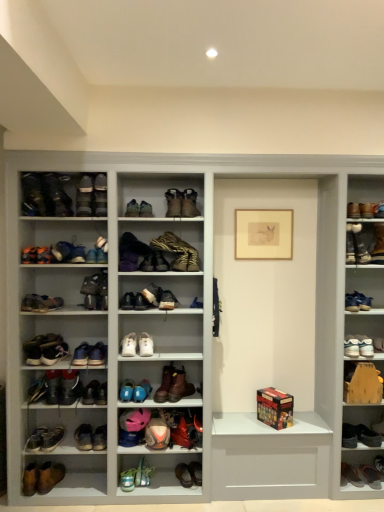
Image resolution: width=384 pixels, height=512 pixels. I want to click on space that is in front of brown leather shoe at lower center, the twentieth footwear viewed from the left, so click(188, 492).